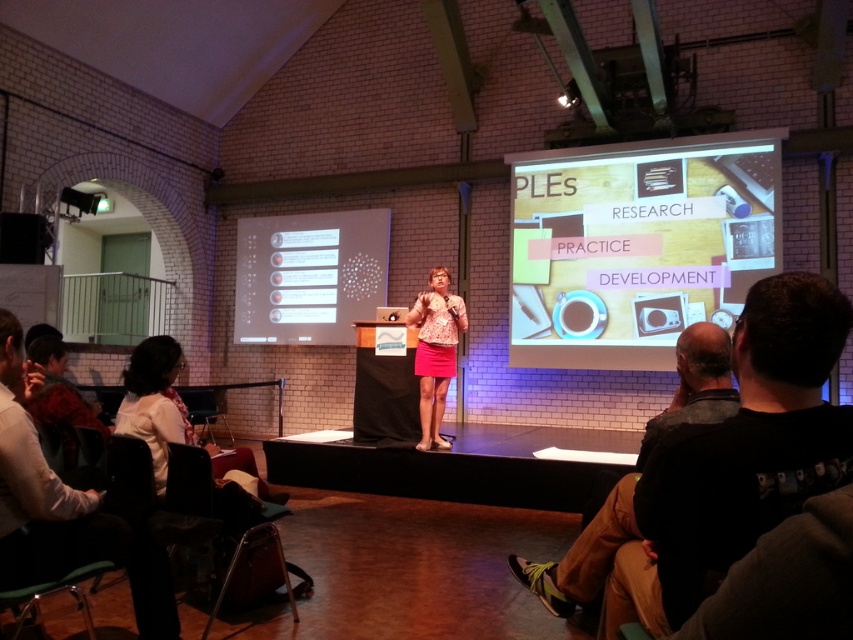
Does point (747, 321) lie in front of point (195, 397)?

Yes, point (747, 321) is closer to viewer.

Could you measure the distance between dark brown leather jacket at lower right and metallic silver chair at lower left?

The distance of dark brown leather jacket at lower right from metallic silver chair at lower left is 5.73 meters.

What do you see at coordinates (717, 470) in the screenshot?
I see `dark brown leather jacket at lower right` at bounding box center [717, 470].

Where is `dark brown leather jacket at lower right`? The height and width of the screenshot is (640, 853). dark brown leather jacket at lower right is located at coordinates (717, 470).

From the picture: Can you confirm if woodenmaterial/textureprojection screen at upper center is thinner than pink fabric skirt at center?

No, woodenmaterial/textureprojection screen at upper center is not thinner than pink fabric skirt at center.

Is woodenmaterial/textureprojection screen at upper center above pink fabric skirt at center?

Yes.

The image size is (853, 640). What do you see at coordinates (637, 244) in the screenshot?
I see `woodenmaterial/textureprojection screen at upper center` at bounding box center [637, 244].

Where is `woodenmaterial/textureprojection screen at upper center`? Image resolution: width=853 pixels, height=640 pixels. woodenmaterial/textureprojection screen at upper center is located at coordinates [637, 244].

Can you confirm if matte white screen at center is positioned above pink fabric skirt at center?

Indeed, matte white screen at center is positioned over pink fabric skirt at center.

Who is shorter, matte white screen at center or pink fabric skirt at center?

Standing shorter between the two is pink fabric skirt at center.

Does point (271, 296) come behind point (422, 442)?

Yes, point (271, 296) is behind point (422, 442).

This screenshot has width=853, height=640. Find the location of `matte white screen at center`. matte white screen at center is located at coordinates tap(309, 275).